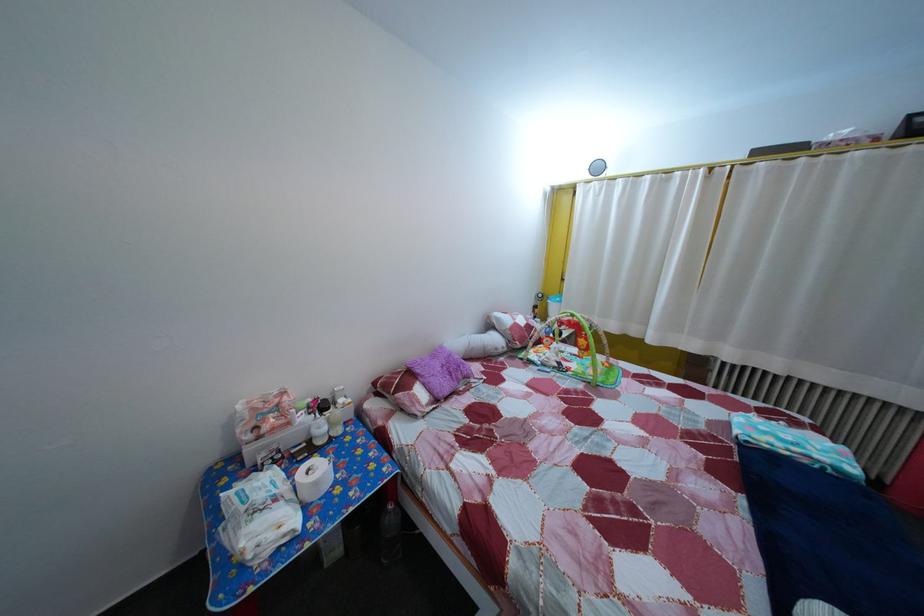
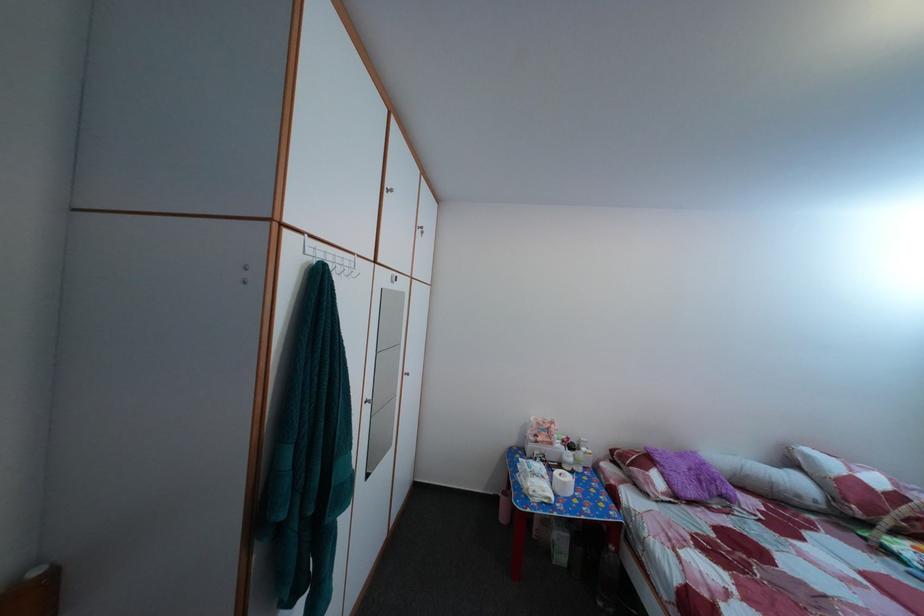
Where in the second image is the point corresponding to point (505, 357) from the first image?

(808, 504)